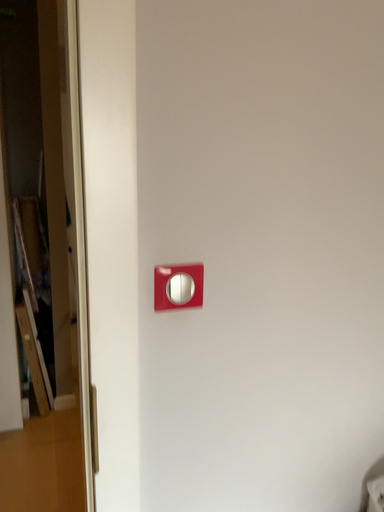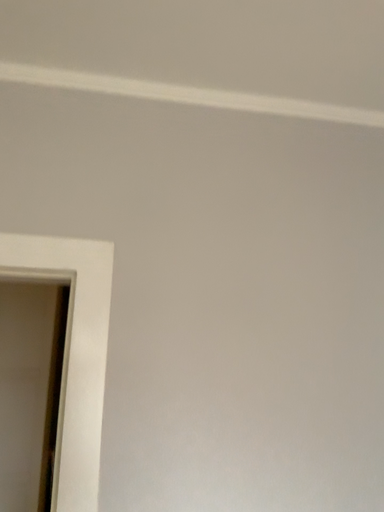
Question: Which way did the camera rotate in the video?

Choices:
 (A) rotated right
 (B) rotated left

Answer: (B)